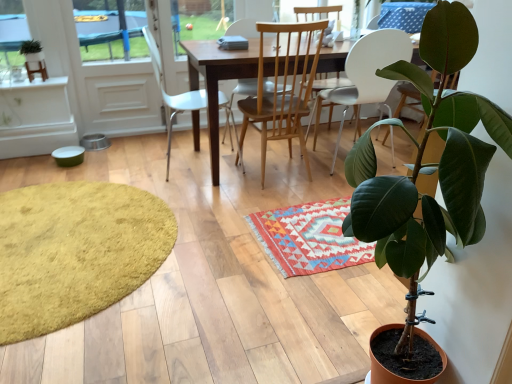
The width and height of the screenshot is (512, 384). I want to click on free area in between white plastic chair at center, placed as the first chair when sorted from left to right, and yellow shaggy rug at lower left, which ranks as the 1th mat in left-to-right order, so click(176, 193).